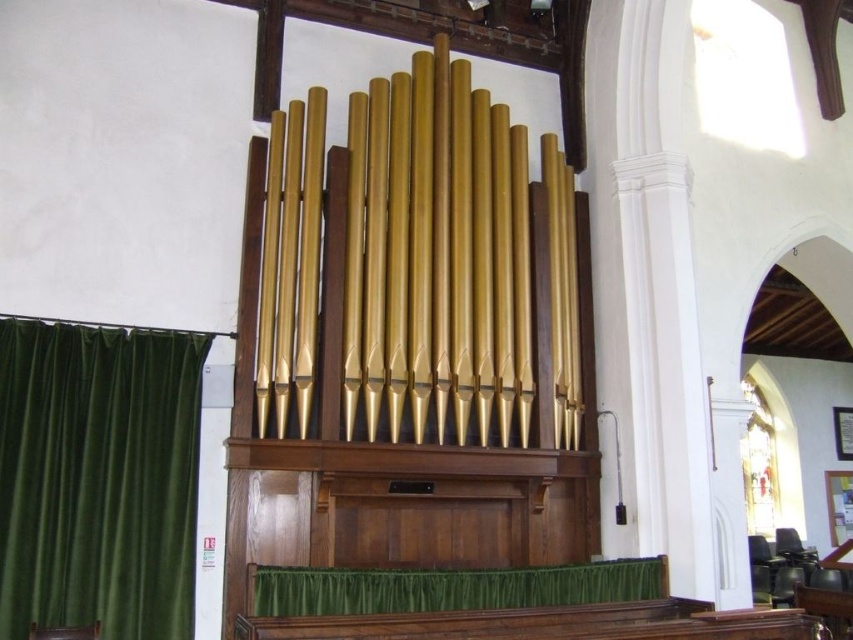
You are standing in the church and want to take a photo of the gold polished pipes at center. If your camera can focus on objects up to 6 meters away, will you be able to capture a clear image?

The gold polished pipes at center are 6.58 meters away from the camera, which is beyond the camera maximum focus range of 6 meters. Therefore, the camera cannot capture a clear image of the gold polished pipes at center.

Consider the image. You are standing in the church and want to locate the gold polished pipes at center. According to their position, where should you look?

The gold polished pipes at center are located at point coordinates approximately 0.406 along the horizontal axis and 0.512 along the vertical axis, so you should look towards the central area slightly to the right and above your current position.